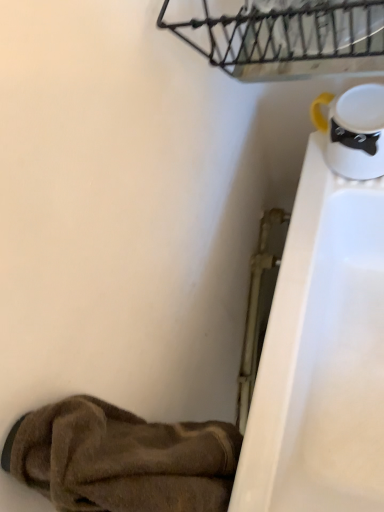
Question: Is rustic metal basket at upper center not near brown fuzzy slipper at lower left?

Choices:
 (A) yes
 (B) no

Answer: (B)

Question: From a real-world perspective, is rustic metal basket at upper center beneath brown fuzzy slipper at lower left?

Choices:
 (A) no
 (B) yes

Answer: (A)

Question: Can you confirm if rustic metal basket at upper center is thinner than brown fuzzy slipper at lower left?

Choices:
 (A) no
 (B) yes

Answer: (A)

Question: From a real-world perspective, is rustic metal basket at upper center over brown fuzzy slipper at lower left?

Choices:
 (A) no
 (B) yes

Answer: (B)

Question: Is rustic metal basket at upper center touching brown fuzzy slipper at lower left?

Choices:
 (A) yes
 (B) no

Answer: (B)

Question: Is rustic metal basket at upper center to the right of brown fuzzy slipper at lower left from the viewer's perspective?

Choices:
 (A) yes
 (B) no

Answer: (A)

Question: Is brown fuzzy slipper at lower left turned away from rustic metal basket at upper center?

Choices:
 (A) no
 (B) yes

Answer: (A)

Question: Is brown fuzzy slipper at lower left not inside rustic metal basket at upper center?

Choices:
 (A) no
 (B) yes

Answer: (B)

Question: Can you confirm if brown fuzzy slipper at lower left is taller than rustic metal basket at upper center?

Choices:
 (A) yes
 (B) no

Answer: (A)

Question: From a real-world perspective, is brown fuzzy slipper at lower left beneath rustic metal basket at upper center?

Choices:
 (A) yes
 (B) no

Answer: (A)

Question: From the image's perspective, does brown fuzzy slipper at lower left appear lower than rustic metal basket at upper center?

Choices:
 (A) yes
 (B) no

Answer: (A)

Question: Considering the relative sizes of brown fuzzy slipper at lower left and rustic metal basket at upper center in the image provided, is brown fuzzy slipper at lower left thinner than rustic metal basket at upper center?

Choices:
 (A) yes
 (B) no

Answer: (A)

Question: Is brown fuzzy slipper at lower left wider or thinner than rustic metal basket at upper center?

Choices:
 (A) thin
 (B) wide

Answer: (A)